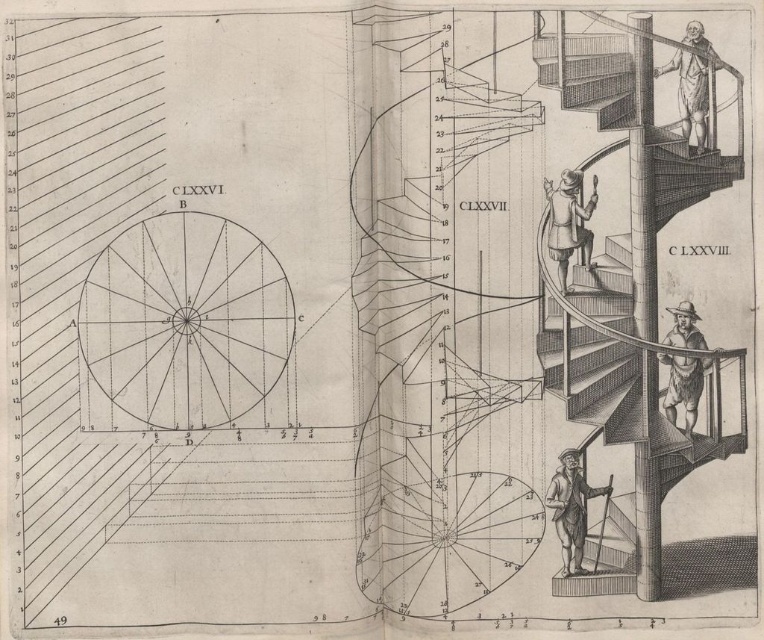
Question: Does brown wood figure at upper right come behind brown wood figure at lower right?

Choices:
 (A) yes
 (B) no

Answer: (B)

Question: Which object appears closest to the camera in this image?

Choices:
 (A) brown leather hat at center
 (B) brown wood figure at upper right
 (C) wooden staircase at center

Answer: (B)

Question: Can you confirm if brown wood figure at upper right is positioned below wooden staff at lower right?

Choices:
 (A) no
 (B) yes

Answer: (A)

Question: Which object is farther from the camera taking this photo?

Choices:
 (A) brown wood figure at upper right
 (B) wooden staircase at center

Answer: (B)

Question: Does brown leather hat at center have a greater width compared to brown wood figure at lower right?

Choices:
 (A) yes
 (B) no

Answer: (A)

Question: Which point appears closest to the camera in this image?

Choices:
 (A) (711, 90)
 (B) (578, 572)

Answer: (A)